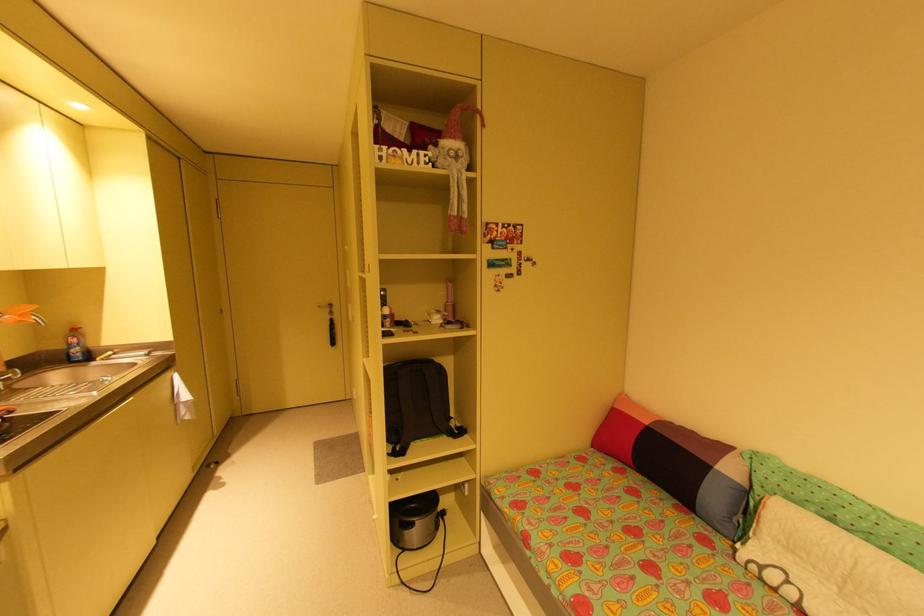
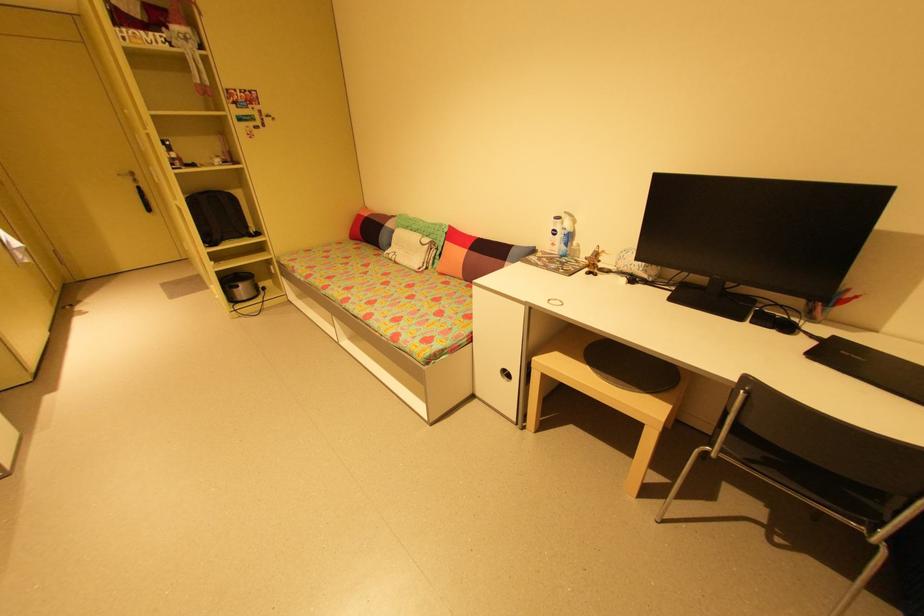
The point at (650, 422) is marked in the first image. Where is the corresponding point in the second image?

(371, 215)